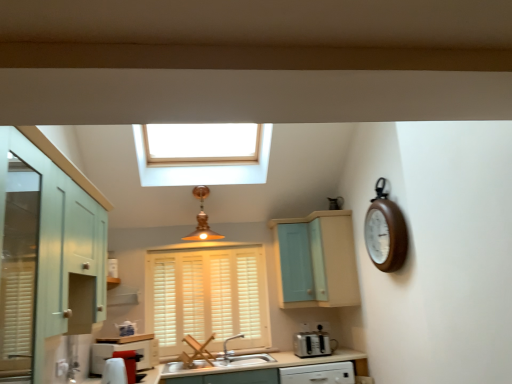
Identify the location of vacant region to the right of satin nickel faucet at sink center. The height and width of the screenshot is (384, 512). (254, 358).